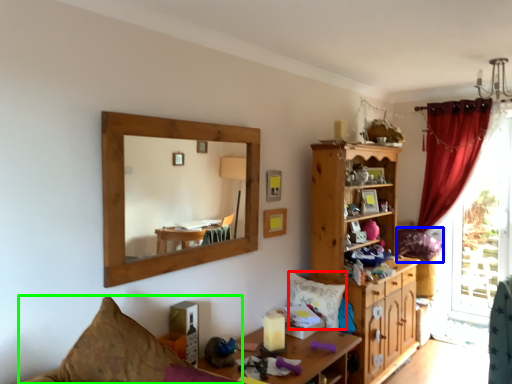
Question: Estimate the real-world distances between objects in this image. Which object is closer to pillow (highlighted by a red box), pillow (highlighted by a blue box) or couch (highlighted by a green box)?

Choices:
 (A) pillow
 (B) couch

Answer: (A)